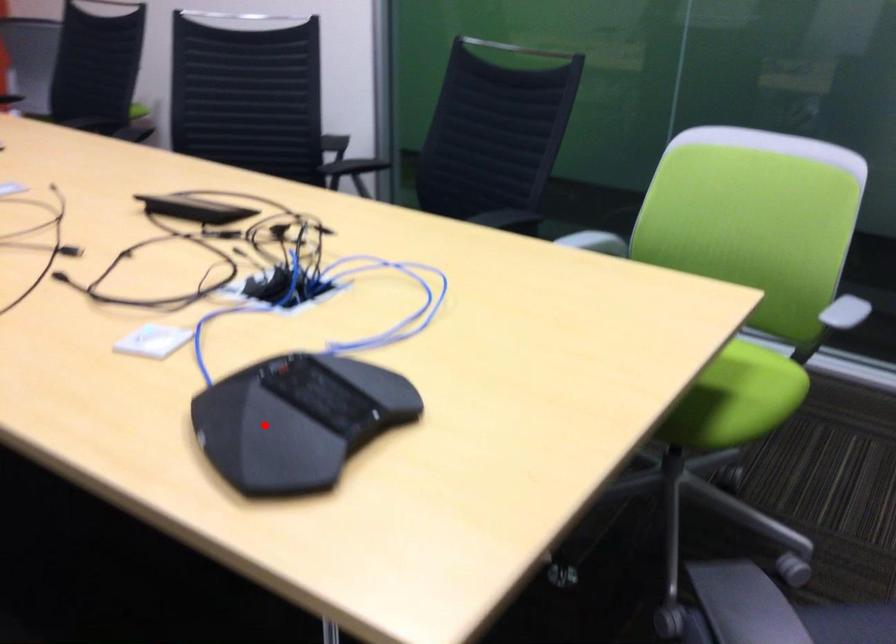
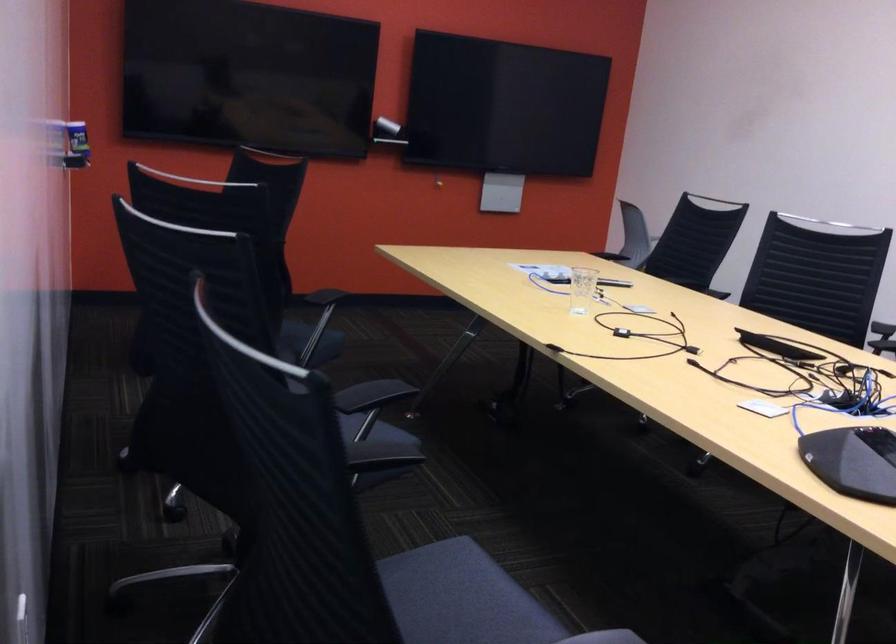
Locate, in the second image, the point that corresponds to the highlighted location in the first image.

(853, 460)